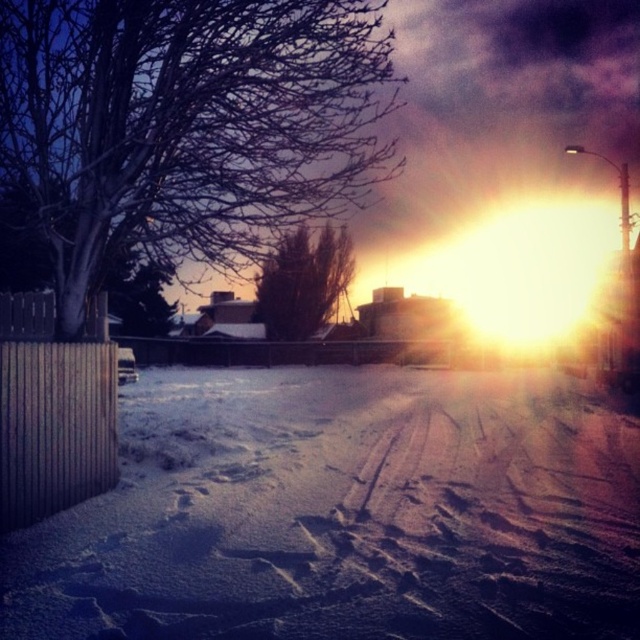
Question: Which object is the closest to the brown textured bush at center?

Choices:
 (A) white powdery snow at center
 (B) bare wood tree at upper left

Answer: (B)

Question: Which object appears farthest from the camera in this image?

Choices:
 (A) brown textured bush at center
 (B) bare wood tree at upper left

Answer: (A)

Question: Does white powdery snow at center lie behind brown textured bush at center?

Choices:
 (A) yes
 (B) no

Answer: (B)

Question: Is bare wood tree at upper left above brown textured bush at center?

Choices:
 (A) no
 (B) yes

Answer: (B)

Question: Based on their relative distances, which object is farther from the bare wood tree at upper left?

Choices:
 (A) brown textured bush at center
 (B) white powdery snow at center

Answer: (B)

Question: Can you confirm if white powdery snow at center is positioned to the right of brown textured bush at center?

Choices:
 (A) yes
 (B) no

Answer: (B)